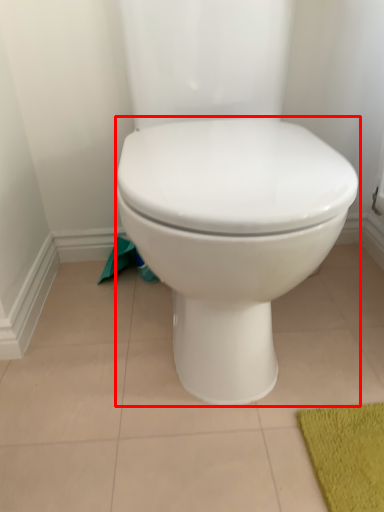
Question: Where is toilet (annotated by the red box) located in relation to toilet paper in the image?

Choices:
 (A) left
 (B) right

Answer: (B)